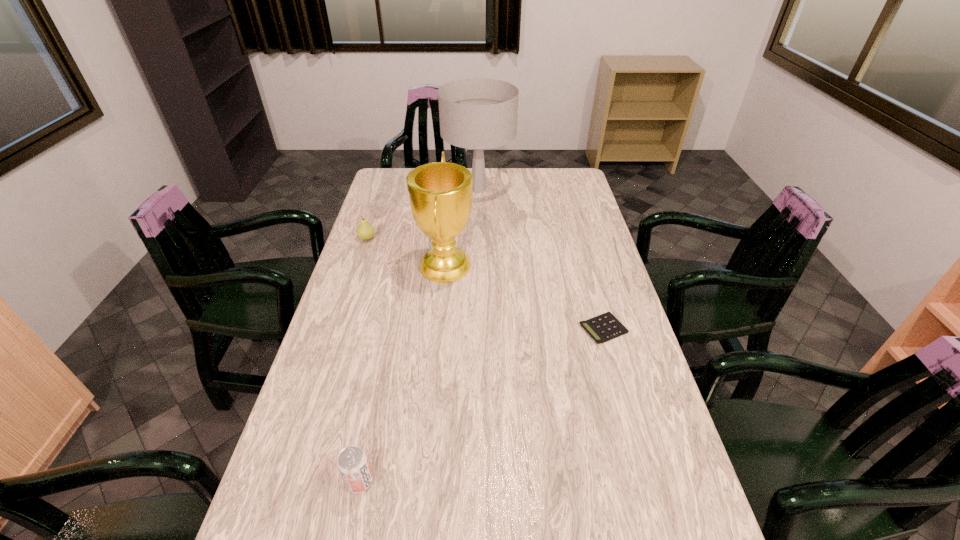
The width and height of the screenshot is (960, 540). Identify the location of vacant space that satisfies the following two spatial constraints: 1. on the shiny surface of the award; 2. on the back side of the rightmost object. (440, 329).